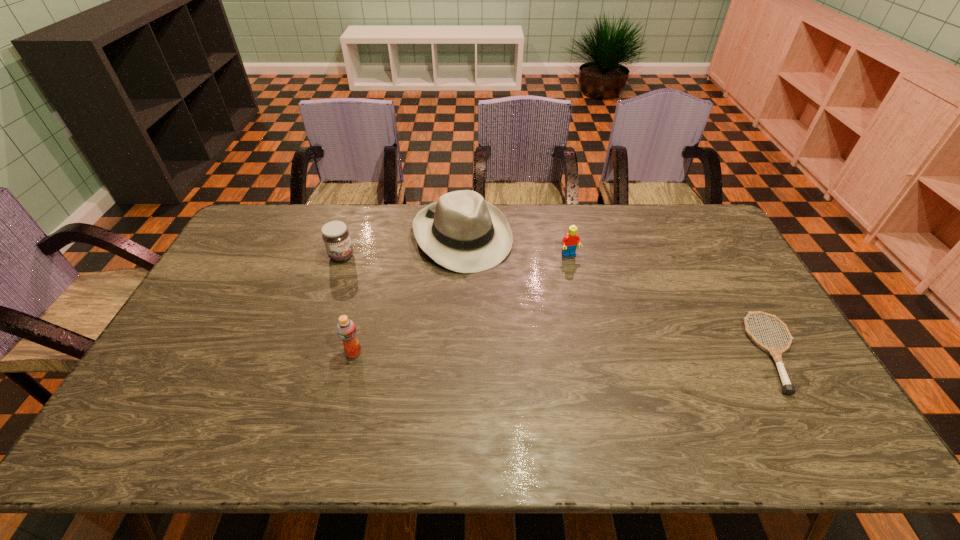
Locate an element on the screen. the fourth object from right to left is located at coordinates (346, 329).

I want to click on the rightmost object, so click(x=776, y=353).

What are the coordinates of `tennis racket` in the screenshot? It's located at pos(776,353).

Identify the location of the fourth object from left to right. (570, 241).

Locate an element on the screen. The image size is (960, 540). fedora is located at coordinates (462, 232).

Where is `the leftmost object`? the leftmost object is located at coordinates (335, 234).

I want to click on free space located 0.190m on the back of the orange juice, so click(x=368, y=296).

Locate an element on the screen. The image size is (960, 540). free space located 0.130m on the back of the rightmost object is located at coordinates (735, 284).

Locate an element on the screen. The height and width of the screenshot is (540, 960). blank space located on the face of the second object from right to left is located at coordinates (609, 326).

Locate an element on the screen. free location located on the face of the second object from right to left is located at coordinates (609, 326).